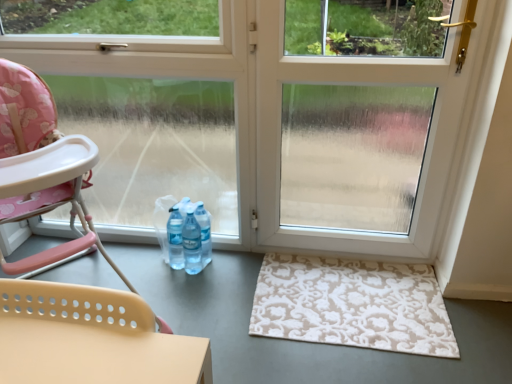
Question: Is beige floral rug at lower right surrounded by pink fabric highchair at left?

Choices:
 (A) no
 (B) yes

Answer: (A)

Question: Is pink fabric highchair at left to the right of beige floral rug at lower right from the viewer's perspective?

Choices:
 (A) no
 (B) yes

Answer: (A)

Question: Is pink fabric highchair at left wider than beige floral rug at lower right?

Choices:
 (A) yes
 (B) no

Answer: (A)

Question: From the image's perspective, is pink fabric highchair at left on top of beige floral rug at lower right?

Choices:
 (A) yes
 (B) no

Answer: (A)

Question: Does pink fabric highchair at left have a larger size compared to beige floral rug at lower right?

Choices:
 (A) no
 (B) yes

Answer: (B)

Question: Does pink fabric highchair at left lie behind beige floral rug at lower right?

Choices:
 (A) no
 (B) yes

Answer: (A)

Question: From a real-world perspective, is beige floral rug at lower right located higher than transparent plastic screen door at center?

Choices:
 (A) no
 (B) yes

Answer: (A)

Question: Is beige floral rug at lower right located outside transparent plastic screen door at center?

Choices:
 (A) yes
 (B) no

Answer: (A)

Question: Is beige floral rug at lower right wider than transparent plastic screen door at center?

Choices:
 (A) no
 (B) yes

Answer: (B)

Question: Is beige floral rug at lower right thinner than transparent plastic screen door at center?

Choices:
 (A) yes
 (B) no

Answer: (B)

Question: Are beige floral rug at lower right and transparent plastic screen door at center making contact?

Choices:
 (A) no
 (B) yes

Answer: (A)

Question: Does beige floral rug at lower right appear on the left side of transparent plastic screen door at center?

Choices:
 (A) yes
 (B) no

Answer: (A)

Question: Could you tell me if pink fabric highchair at left is facing transparent plastic screen door at center?

Choices:
 (A) yes
 (B) no

Answer: (B)